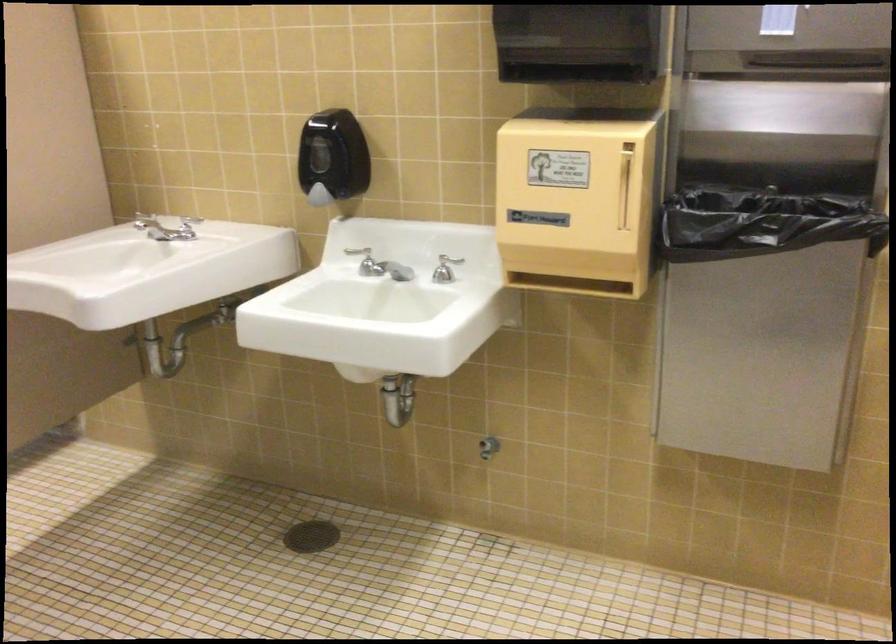
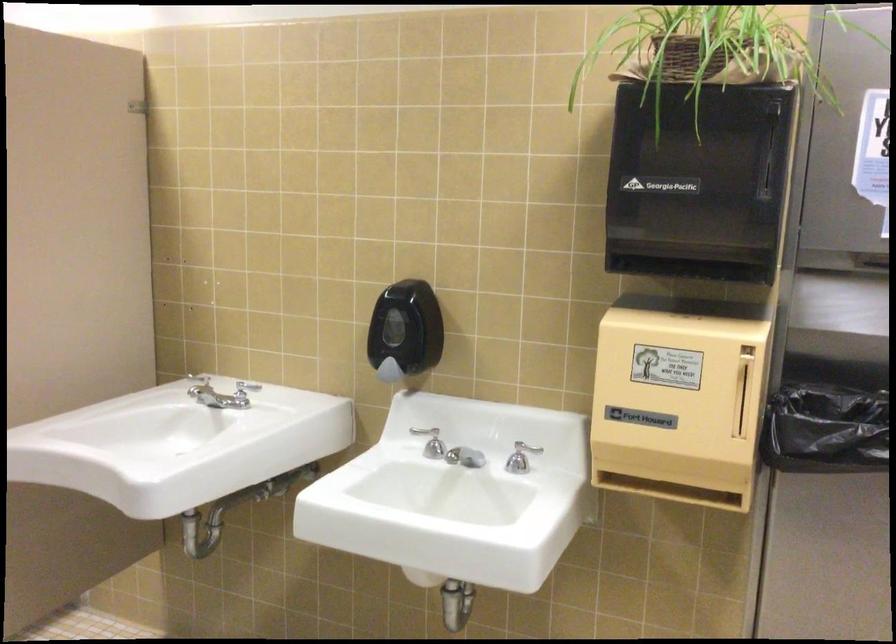
In the second image, find the point that corresponds to pixel 316 200 in the first image.

(389, 371)